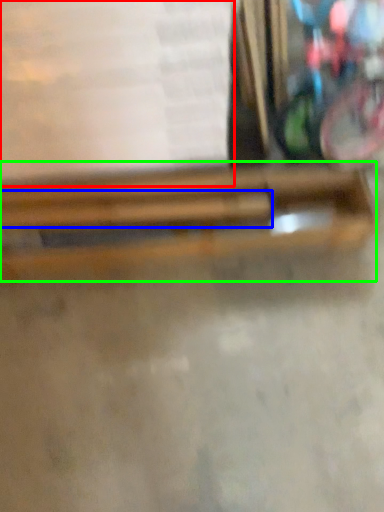
Question: Which is farther away from paperback book (highlighted by a red box)? wood (highlighted by a blue box) or wood (highlighted by a green box)?

Choices:
 (A) wood
 (B) wood

Answer: (A)